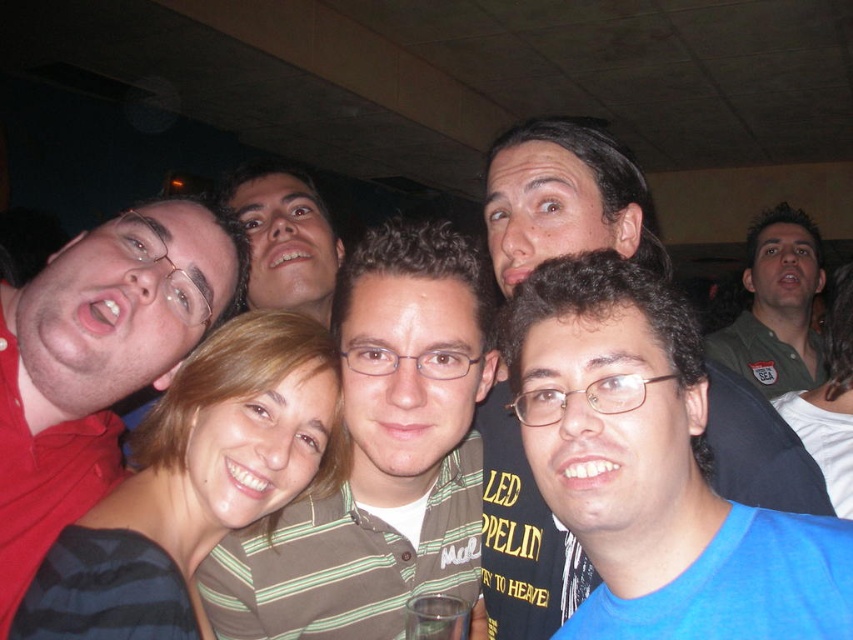
You are a photographer trying to adjust the lighting for a group photo. You notice two shirts in the image, the matte red shirt at left and the blue matte shirt at center. Which shirt should you focus on first if you want to ensure both are well lit, considering their positions?

The matte red shirt at left is not as tall as the blue matte shirt at center, so you should focus on the blue matte shirt at center first to ensure proper lighting since it is taller and might require more attention.

You are a photographer trying to adjust the lighting for a group photo. You notice two shirts in the scene, the matte red shirt at left and the blue matte shirt at center. Which shirt should you focus on to ensure both are well lit, considering their size in the frame?

The matte red shirt at left occupies less space than the blue matte shirt at center, so focusing on the blue matte shirt at center would ensure proper lighting for both since it takes up more of the frame.